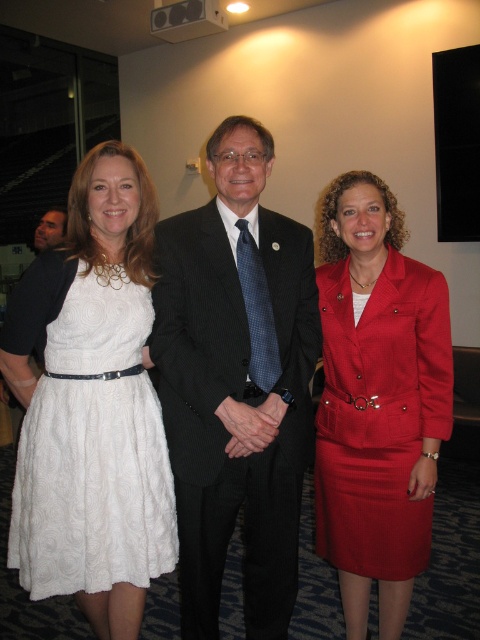
You are standing in the conference room and want to locate the point at coordinates (236, 381). Based on the scene description, where would this point be located?

The point at coordinates (236, 381) is located on the black pinstripe suit at center.

You are standing in the conference room and want to place a small potted plant at point (277, 412). The plant requires a minimum of 4 feet of space from the nearest wall to avoid blocking walkways. Can you confirm if the point is at least 4 feet away from the nearest wall?

The distance of point (277, 412) from viewer is 5.63 feet, so yes, the point is at least 4 feet away from the nearest wall, meeting the plant placement requirement.